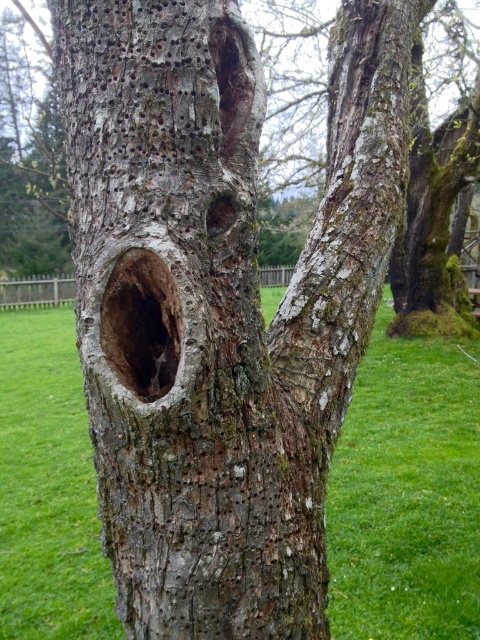
Is green grass at center below smooth bark hole at center?

No.

This screenshot has width=480, height=640. In order to click on green grass at center in this screenshot , I will do `click(407, 493)`.

Who is more distant from viewer, [417,140] or [156,266]?

The point [417,140] is more distant.

Can you confirm if green mossy bark at upper right is positioned above smooth bark hole at center?

Indeed, green mossy bark at upper right is positioned over smooth bark hole at center.

You are a GUI agent. You are given a task and a screenshot of the screen. Output one action in this format:
    pyautogui.click(x=<x>, y=<y>)
    Task: Click on the green mossy bark at upper right
    This screenshot has width=480, height=640.
    Given the screenshot: What is the action you would take?
    pyautogui.click(x=432, y=225)

Does green grass at center have a lesser width compared to green mossy bark at upper right?

No, green grass at center is not thinner than green mossy bark at upper right.

Is green grass at center taller than green mossy bark at upper right?

No.

Locate an element on the screen. green grass at center is located at coordinates (407, 493).

Locate an element on the screen. green grass at center is located at coordinates (407, 493).